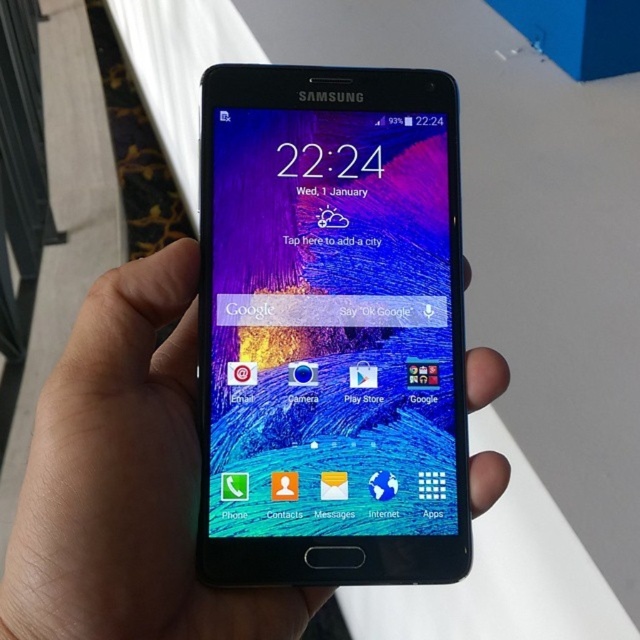
You are trying to choose between two phones displayed in a store window. The matte glass phone at center and the black matte phone at center are both on display. Based on their physical dimensions, which one would you pick if you prefer a narrower phone?

The matte glass phone at center has a lesser width compared to black matte phone at center, so it would be the better choice for someone preferring a narrower phone.

From the picture: You are looking at the Samsung smartphone screen. There are two points on the screen at coordinates point [244,524] and point [24,509]. Which point is closer to you?

Point [244,524] is further to the viewer than point [24,509], so the point closer to you is point [24,509].

You are trying to decide between two phone cases. The matte glass phone at center and the black matte phone at center. Which case would you choose if you want the one that takes up more space?

The black matte phone at center takes up more space than the matte glass phone at center, so you should choose the black matte phone at center.